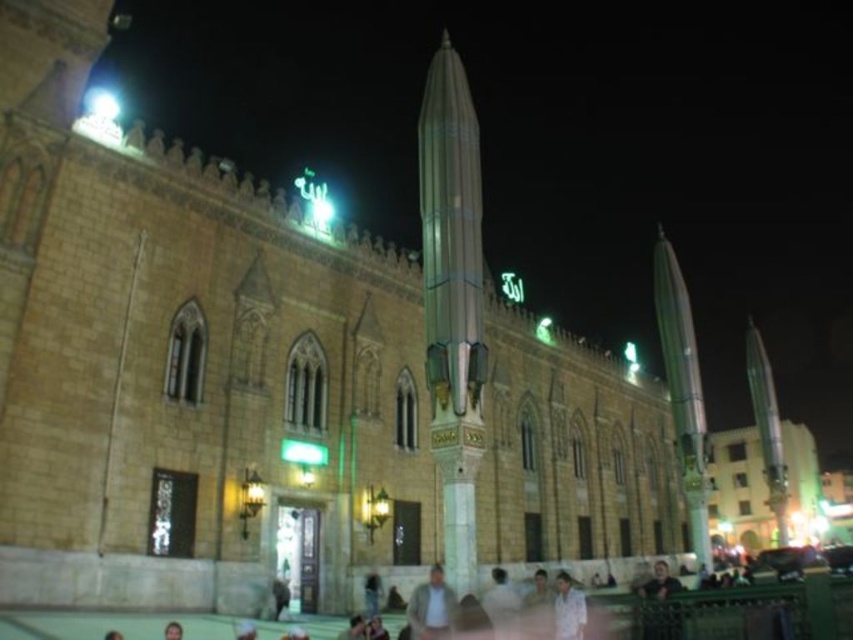
Between light brown leather jacket at center and white cotton shirt at lower center, which one is positioned lower?

white cotton shirt at lower center is lower down.

Which is in front, point (432, 596) or point (560, 602)?

Positioned in front is point (432, 596).

Does point (419, 598) lie in front of point (572, 637)?

No.

Identify the location of light brown leather jacket at center. Image resolution: width=853 pixels, height=640 pixels. (431, 608).

Is green glass spire at center below light brown leather jacket at center?

No, green glass spire at center is not below light brown leather jacket at center.

Between green glass spire at center and light brown leather jacket at center, which one appears on the right side from the viewer's perspective?

green glass spire at center

Is point (463, 157) positioned behind point (448, 602)?

Yes.

You are a GUI agent. You are given a task and a screenshot of the screen. Output one action in this format:
    pyautogui.click(x=<x>, y=<y>)
    Task: Click on the green glass spire at center
    
    Given the screenshot: What is the action you would take?
    pyautogui.click(x=451, y=236)

Is green glass spire at center shorter than white cotton shirt at lower center?

In fact, green glass spire at center may be taller than white cotton shirt at lower center.

Can you confirm if green glass spire at center is positioned above white cotton shirt at lower center?

Yes.

The height and width of the screenshot is (640, 853). Describe the element at coordinates (451, 236) in the screenshot. I see `green glass spire at center` at that location.

Find the location of a particular element. The image size is (853, 640). green glass spire at center is located at coordinates (451, 236).